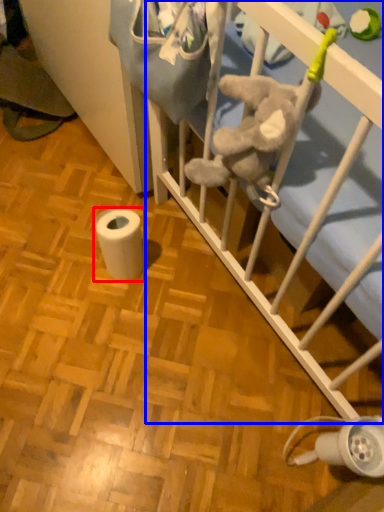
Question: Which of the following is the farthest to the observer, toilet paper (highlighted by a red box) or infant bed (highlighted by a blue box)?

Choices:
 (A) toilet paper
 (B) infant bed

Answer: (A)